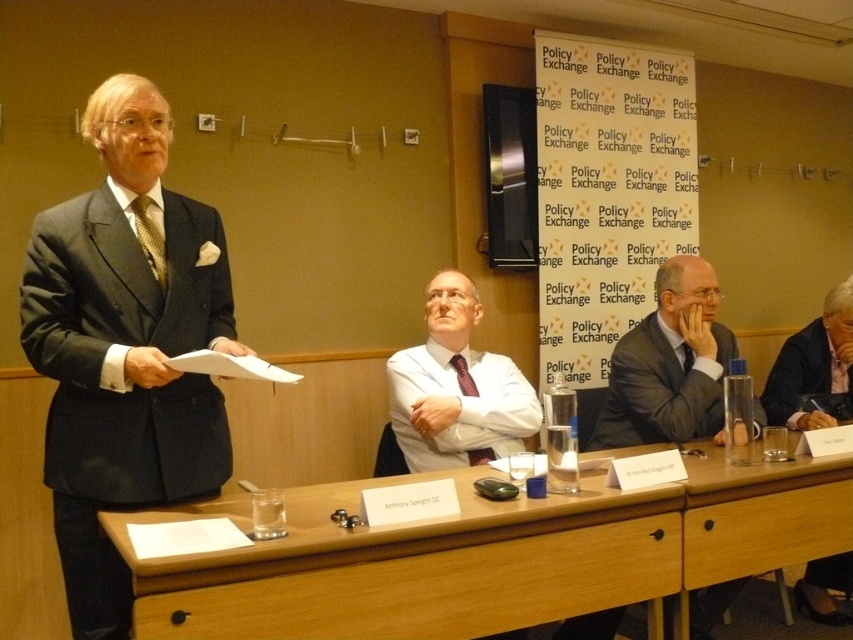
Question: Which object is farther from the camera taking this photo?

Choices:
 (A) wooden at center
 (B) wooden table at lower center

Answer: (A)

Question: Which of the following is the farthest from the observer?

Choices:
 (A) (849, 557)
 (B) (165, 342)
 (C) (294, 532)

Answer: (A)

Question: Is wooden at center below matte red tie at center?

Choices:
 (A) yes
 (B) no

Answer: (A)

Question: In this image, where is wooden table at lower center located relative to matte red tie at center?

Choices:
 (A) right
 (B) left

Answer: (B)

Question: Among these points, which one is nearest to the camera?

Choices:
 (A) [x=541, y=500]
 (B) [x=838, y=556]

Answer: (A)

Question: Is matte black suit at left below wooden at center?

Choices:
 (A) no
 (B) yes

Answer: (A)